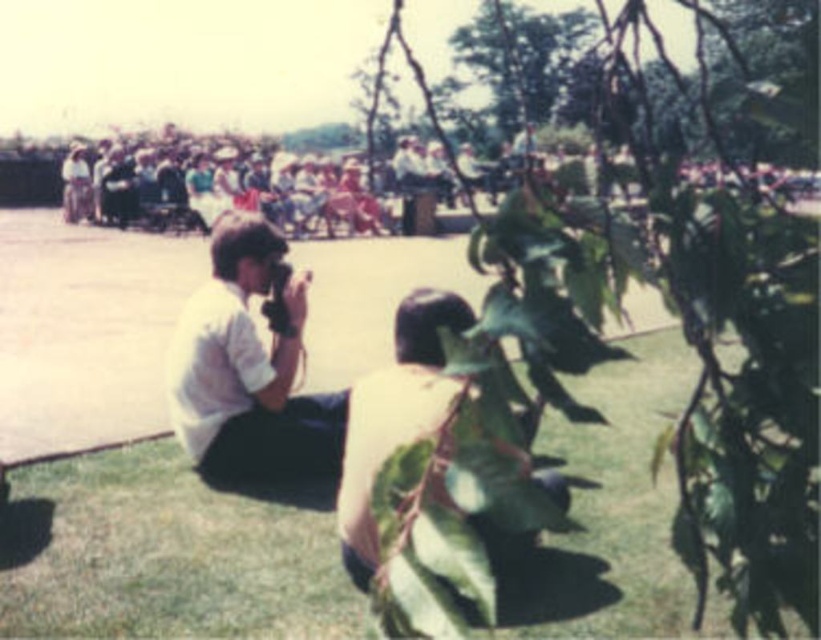
Who is shorter, green leafy tree at center or green grass at lower center?

green grass at lower center is shorter.

Locate an element on the screen. This screenshot has width=821, height=640. green leafy tree at center is located at coordinates (620, 358).

Does point (512, 260) come behind point (654, 390)?

No, it is not.

The image size is (821, 640). In order to click on green leafy tree at center in this screenshot , I will do `click(620, 358)`.

Does green grass at lower center lie in front of white matte camera at center?

Yes, green grass at lower center is closer to the viewer.

Where is `green grass at lower center`? This screenshot has height=640, width=821. green grass at lower center is located at coordinates click(163, 556).

Does point (728, 532) come behind point (182, 404)?

No, (728, 532) is closer to viewer.

Who is positioned more to the left, green leafy tree at center or white matte camera at center?

Positioned to the left is white matte camera at center.

Identify the location of green leafy tree at center. (620, 358).

Identify the location of green leafy tree at center. This screenshot has height=640, width=821. (620, 358).